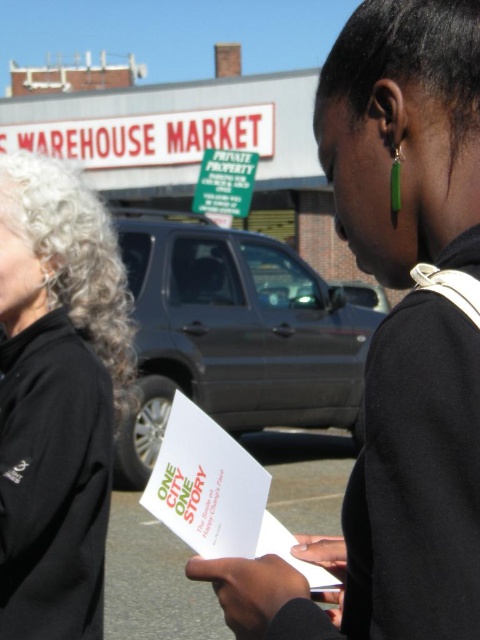
Question: Where is matte black paper at center located in relation to black fleece jacket at left in the image?

Choices:
 (A) left
 (B) right

Answer: (B)

Question: Where is matte black paper at center located in relation to black fleece jacket at left in the image?

Choices:
 (A) above
 (B) below

Answer: (A)

Question: Can you confirm if matte black paper at center is positioned to the right of black fleece jacket at left?

Choices:
 (A) no
 (B) yes

Answer: (B)

Question: Which of the following is the farthest from the observer?

Choices:
 (A) matte black paper at center
 (B) black fleece jacket at left

Answer: (B)

Question: Among these points, which one is nearest to the camera?

Choices:
 (A) (9, 257)
 (B) (396, 17)

Answer: (B)

Question: Among these points, which one is farthest from the camera?

Choices:
 (A) (447, 108)
 (B) (41, 602)

Answer: (B)